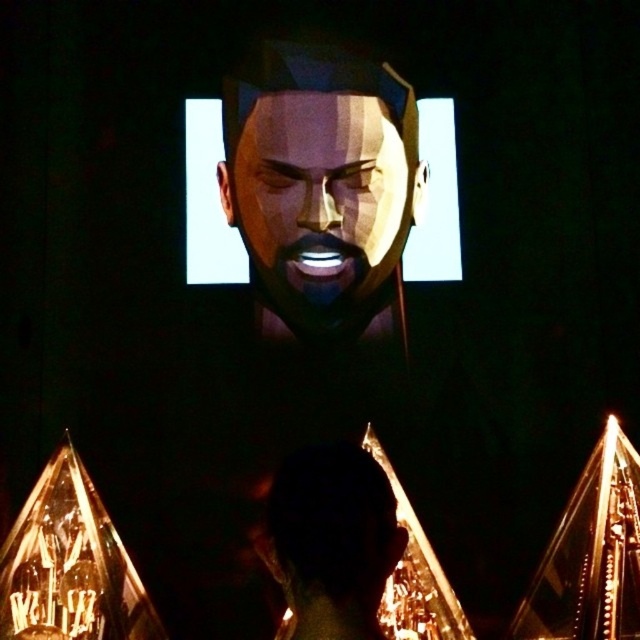
Looking at this image, you are an observer in the scene. You notice the matte metallic face at center and the black matte head at center. Which object is located to the right side?

The black matte head at center is located to the right side of the matte metallic face at center.

Looking at this image, you are an observer analyzing the spatial arrangement of the scene. Which object is positioned higher in the image, the matte metallic face at center or the black matte head at center?

The matte metallic face at center is positioned above the black matte head at center, so it is higher in the image.

You are an artist trying to draw this scene. You need to ensure that the proportions between the matte metallic face at center and the black matte head at center are accurate. Which object should you draw first to establish the correct scale, and why?

You should draw the matte metallic face at center first because its width is larger than the black matte head at center, so starting with the larger object helps establish the correct scale for the smaller one.